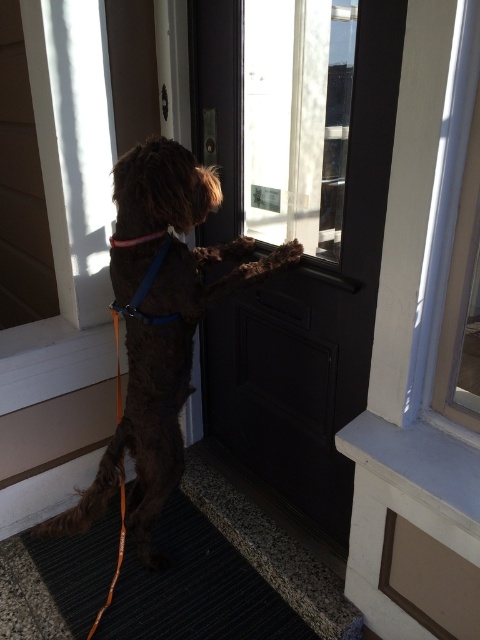
Question: Which is farther from the blue fabric neckband at upper center?

Choices:
 (A) dark gray textured mat at lower center
 (B) brown furry dog at center

Answer: (A)

Question: Which object appears farthest from the camera in this image?

Choices:
 (A) dark gray textured mat at lower center
 (B) transparent glass door at upper center
 (C) brown furry dog at center

Answer: (A)

Question: Estimate the real-world distances between objects in this image. Which object is farther from the dark gray textured mat at lower center?

Choices:
 (A) black wooden door at center
 (B) transparent glass door at upper center
 (C) blue fabric neckband at upper center

Answer: (B)

Question: Observing the image, what is the correct spatial positioning of brown furry dog at center in reference to dark gray textured mat at lower center?

Choices:
 (A) right
 (B) left

Answer: (A)

Question: Does brown furry dog at center appear on the right side of dark gray textured mat at lower center?

Choices:
 (A) no
 (B) yes

Answer: (B)

Question: Is black wooden door at center closer to the viewer compared to brown furry dog at center?

Choices:
 (A) yes
 (B) no

Answer: (A)